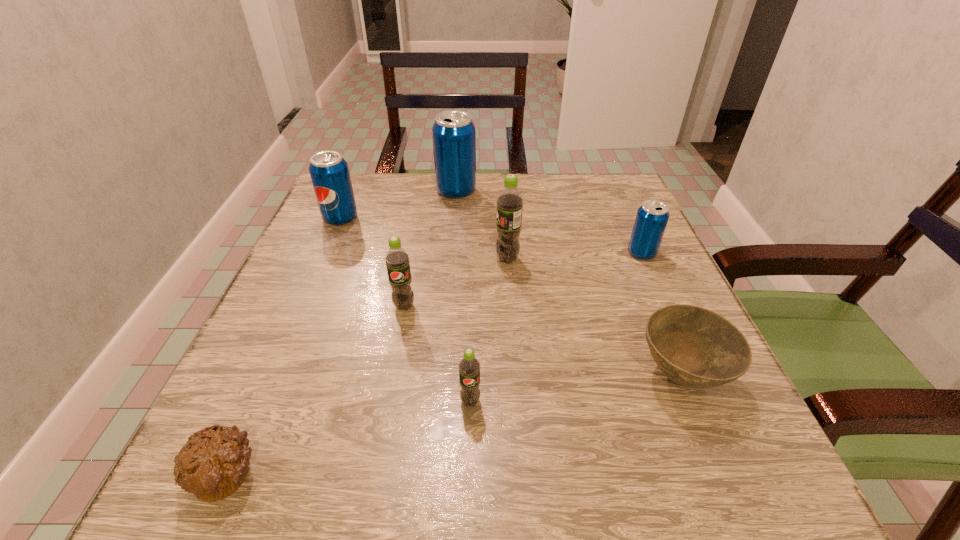
I want to click on the second blue pop soda from left to right, so click(454, 134).

The image size is (960, 540). What are the coordinates of `the farthest soda` in the screenshot? It's located at (454, 134).

Find the location of a particular element. The height and width of the screenshot is (540, 960). the farthest green soda is located at coordinates (510, 202).

Find the location of a particular element. This screenshot has width=960, height=540. the rightmost green soda is located at coordinates (510, 202).

Find the location of a particular element. Image resolution: width=960 pixels, height=540 pixels. the leftmost soda is located at coordinates (329, 172).

Locate an element on the screen. The width and height of the screenshot is (960, 540). the second biggest blue pop soda is located at coordinates (329, 172).

You are a GUI agent. You are given a task and a screenshot of the screen. Output one action in this format:
    pyautogui.click(x=<x>, y=<y>)
    Task: Click on the fifth farthest soda
    The height and width of the screenshot is (540, 960).
    Given the screenshot: What is the action you would take?
    pyautogui.click(x=397, y=259)

You are a GUI agent. You are given a task and a screenshot of the screen. Output one action in this format:
    pyautogui.click(x=<x>, y=<y>)
    Task: Click on the second biggest green soda
    
    Given the screenshot: What is the action you would take?
    pyautogui.click(x=397, y=259)

The height and width of the screenshot is (540, 960). Identify the location of the smallest blue pop soda. (652, 216).

The height and width of the screenshot is (540, 960). What are the coordinates of `the rightmost soda` in the screenshot? It's located at (652, 216).